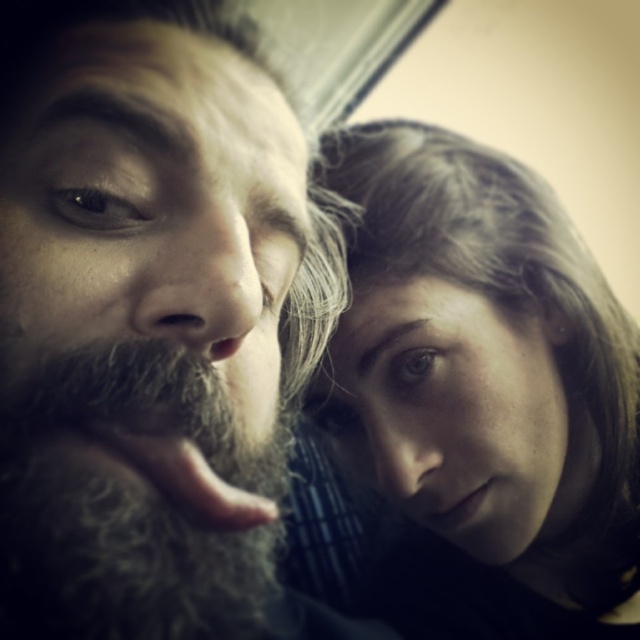
You are a photographer trying to adjust the lighting for a portrait. You notice the smooth brown hair at upper right and the gray fuzzy beard at left in the frame. Which object should you focus on to ensure proper exposure since it is taller?

The smooth brown hair at upper right is much taller as gray fuzzy beard at left, so you should focus on the smooth brown hair at upper right to ensure proper exposure because it is taller.